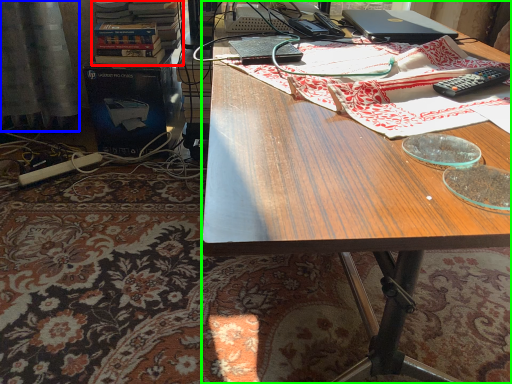
Question: Which object is the farthest from book (highlighted by a red box)? Choose among these: curtain (highlighted by a blue box) or desk (highlighted by a green box).

Choices:
 (A) curtain
 (B) desk

Answer: (B)